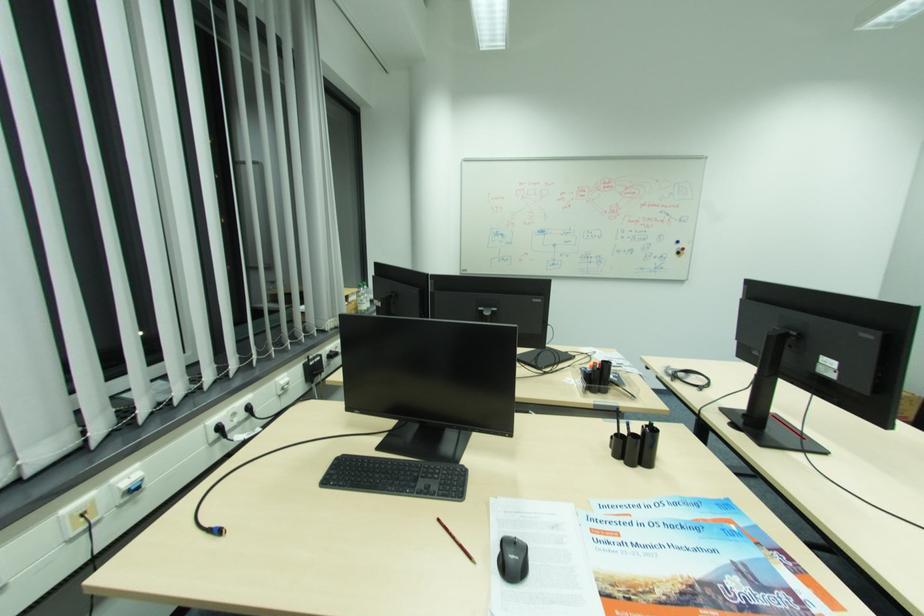
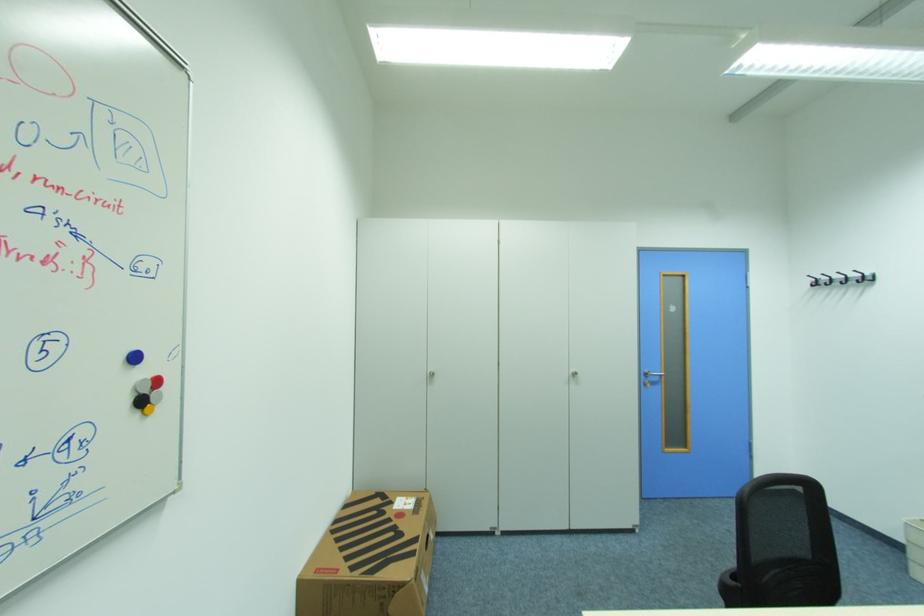
Locate, in the second image, the point that corresponds to point 688,249 in the first image.

(162, 382)